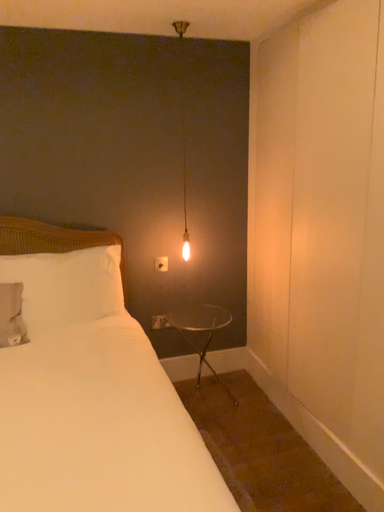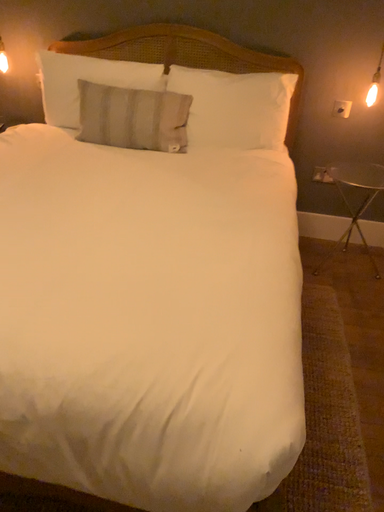
Question: How did the camera likely rotate when shooting the video?

Choices:
 (A) rotated upward
 (B) rotated downward

Answer: (B)